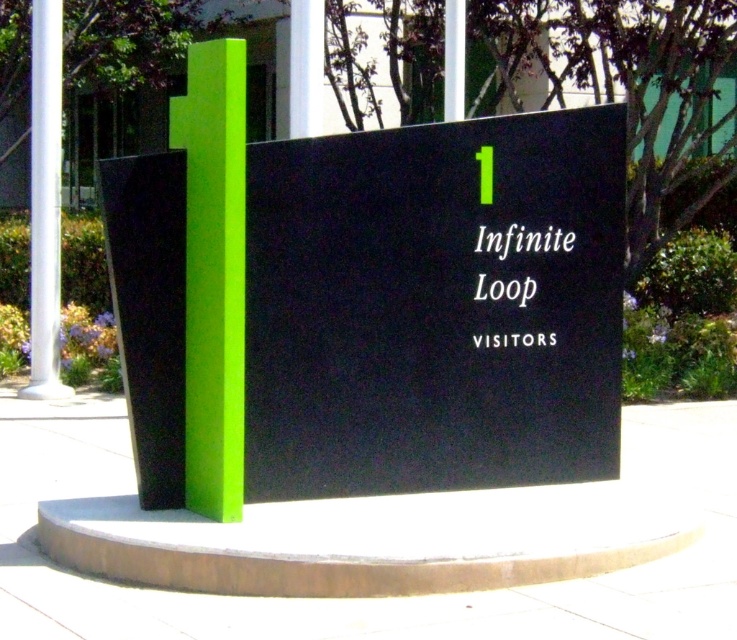
Does lime green plastic pillar at left appear on the left side of whitematerial/textureinfinite loopobject at center?

Correct, you'll find lime green plastic pillar at left to the left of whitematerial/textureinfinite loopobject at center.

Measure the distance between point [198,225] and camera.

Point [198,225] is 16.80 feet from camera.

I want to click on lime green plastic pillar at left, so click(x=213, y=273).

Describe the element at coordinates (433, 307) in the screenshot. I see `matte black sign at center` at that location.

Find the location of a particular element. The width and height of the screenshot is (737, 640). matte black sign at center is located at coordinates (433, 307).

Does point (621, 200) lie behind point (31, 17)?

No, (621, 200) is in front of (31, 17).

The width and height of the screenshot is (737, 640). I want to click on matte black sign at center, so click(433, 307).

Measure the distance from white smooth pole at left to whitematerial/textureinfinite loopobject at center.

white smooth pole at left and whitematerial/textureinfinite loopobject at center are 17.93 feet apart from each other.

Between white smooth pole at left and whitematerial/textureinfinite loopobject at center, which one appears on the right side from the viewer's perspective?

whitematerial/textureinfinite loopobject at center

Image resolution: width=737 pixels, height=640 pixels. What do you see at coordinates (45, 200) in the screenshot?
I see `white smooth pole at left` at bounding box center [45, 200].

Identify the location of white smooth pole at left. This screenshot has width=737, height=640. (45, 200).